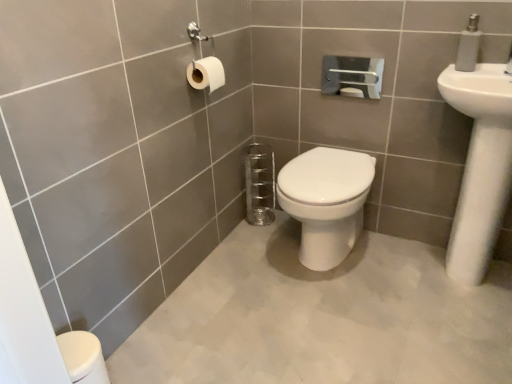
Identify the location of vacant region in front of white plastic soap dispenser at upper right. This screenshot has height=384, width=512. (478, 74).